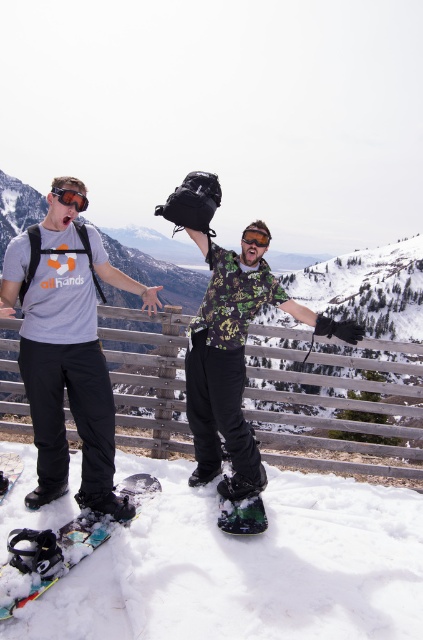
Is point (10, 280) positioned behind point (41, 237)?

Yes.

Between point (203, 333) and point (65, 312), which one is positioned in front?

Point (65, 312)

Find the location of a particular element. The image size is (423, 640). matte black snowboard at center is located at coordinates (60, 323).

Which is in front, point (27, 243) or point (80, 202)?

Point (27, 243) is in front.

Which is more to the right, matte black snowboard at center or matte black goggles at upper left?

matte black snowboard at center

Which is in front, point (208, 243) or point (66, 188)?

Point (66, 188)

Identify the location of matte black snowboard at center. The height and width of the screenshot is (640, 423). (60, 323).

Who is positioned more to the right, matte gray t-shirt at center or matte orange goggles at center?

Positioned to the right is matte orange goggles at center.

Does matte gray t-shirt at center have a lesser width compared to matte orange goggles at center?

No, matte gray t-shirt at center is not thinner than matte orange goggles at center.

Is point (84, 349) less distant than point (252, 241)?

Yes, point (84, 349) is in front of point (252, 241).

At what (x,y) coordinates should I click in order to perform the action: click on matte gray t-shirt at center. Please return your answer as a coordinate pair (x, y). Looking at the image, I should click on (66, 348).